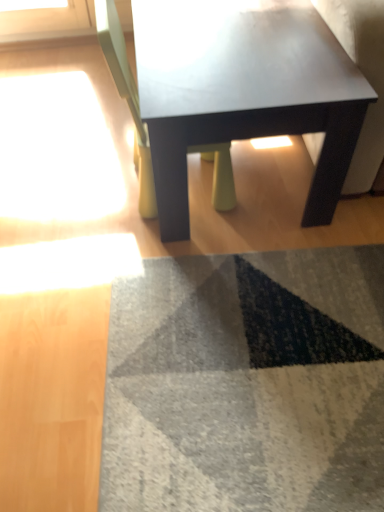
Describe the element at coordinates (243, 91) in the screenshot. I see `matte black coffee table at center` at that location.

You are a GUI agent. You are given a task and a screenshot of the screen. Output one action in this format:
    pyautogui.click(x=<x>, y=<y>)
    Task: Click on the matte black coffee table at center
    Image resolution: width=384 pixels, height=512 pixels.
    Given the screenshot: What is the action you would take?
    pyautogui.click(x=243, y=91)

The height and width of the screenshot is (512, 384). Identify the location of matte white chair at center. (127, 99).

What do you see at coordinates (127, 99) in the screenshot? The width and height of the screenshot is (384, 512). I see `matte white chair at center` at bounding box center [127, 99].

Find the location of a particular element. matte black coffee table at center is located at coordinates (243, 91).

Is matte black coffee table at center to the left of matte white chair at center from the viewer's perspective?

No, matte black coffee table at center is not to the left of matte white chair at center.

Considering the positions of objects matte black coffee table at center and matte white chair at center in the image provided, who is in front, matte black coffee table at center or matte white chair at center?

matte white chair at center is closer to the camera.

Is point (240, 109) closer to camera compared to point (128, 92)?

Yes, it is.

From the image's perspective, is matte black coffee table at center above or below matte white chair at center?

matte black coffee table at center is above matte white chair at center.

From a real-world perspective, who is located lower, matte black coffee table at center or matte white chair at center?

matte black coffee table at center.

Which of these two, matte black coffee table at center or matte white chair at center, is wider?

matte black coffee table at center.

Considering the relative sizes of matte black coffee table at center and matte white chair at center in the image provided, is matte black coffee table at center taller than matte white chair at center?

No.

Considering the sizes of objects matte black coffee table at center and matte white chair at center in the image provided, who is bigger, matte black coffee table at center or matte white chair at center?

matte black coffee table at center.

From the picture: Is matte black coffee table at center situated inside matte white chair at center or outside?

The correct answer is: outside.

Is matte black coffee table at center beside matte white chair at center?

No.

Is matte black coffee table at center facing away from matte white chair at center?

Absolutely, matte black coffee table at center is directed away from matte white chair at center.

Can you tell me how much matte black coffee table at center and matte white chair at center differ in facing direction?

There is a 179-degree angle between the facing directions of matte black coffee table at center and matte white chair at center.

Locate an element on the screen. This screenshot has height=512, width=384. coffee table that is above the matte white chair at center (from the image's perspective) is located at coordinates [x=243, y=91].

Visually, is matte white chair at center positioned to the left or to the right of matte black coffee table at center?

matte white chair at center is to the left of matte black coffee table at center.

Between matte white chair at center and matte black coffee table at center, which one is positioned behind?

Positioned behind is matte black coffee table at center.

Is point (142, 130) positioned after point (210, 8)?

That is False.

From the image's perspective, which is below, matte white chair at center or matte black coffee table at center?

matte white chair at center, from the image's perspective.

From a real-world perspective, between matte white chair at center and matte black coffee table at center, who is vertically higher?

From a 3D spatial view, matte white chair at center is above.

Is matte white chair at center wider or thinner than matte black coffee table at center?

Considering their sizes, matte white chair at center looks slimmer than matte black coffee table at center.

Which of these two, matte white chair at center or matte black coffee table at center, stands shorter?

With less height is matte black coffee table at center.

Between matte white chair at center and matte black coffee table at center, which one has larger size?

With larger size is matte black coffee table at center.

Is matte white chair at center located outside matte black coffee table at center?

No, matte white chair at center is inside matte black coffee table at center's boundary.

Does matte white chair at center touch matte black coffee table at center?

matte white chair at center and matte black coffee table at center are not in contact.

Consider the image. Is matte black coffee table at center at the back of matte white chair at center?

Yes, matte white chair at center is facing away from matte black coffee table at center.

How many degrees apart are the facing directions of matte white chair at center and matte black coffee table at center?

Answer: The facing directions of matte white chair at center and matte black coffee table at center are 179 degrees apart.

This screenshot has width=384, height=512. In the image, there is a matte white chair at center. Identify the location of coffee table above it (from the image's perspective). (243, 91).

Image resolution: width=384 pixels, height=512 pixels. Identify the location of coffee table that is behind the matte white chair at center. (243, 91).

At what (x,y) coordinates should I click in order to perform the action: click on coffee table above the matte white chair at center (from the image's perspective). Please return your answer as a coordinate pair (x, y). This screenshot has height=512, width=384. Looking at the image, I should click on (243, 91).